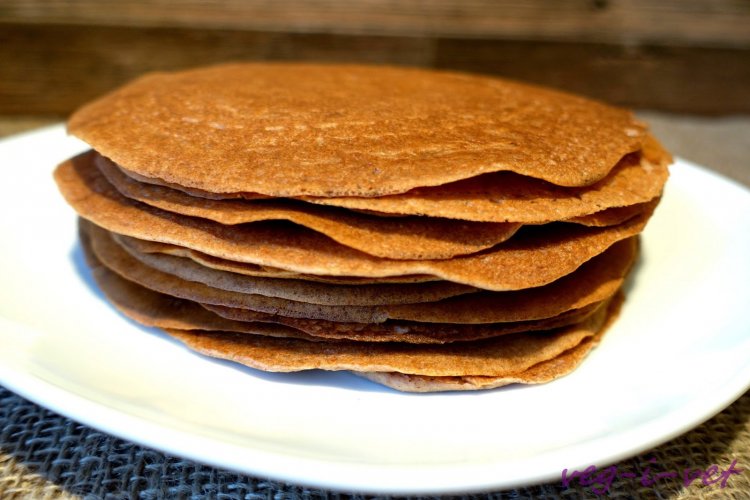
Identify the location of table. (82, 47).